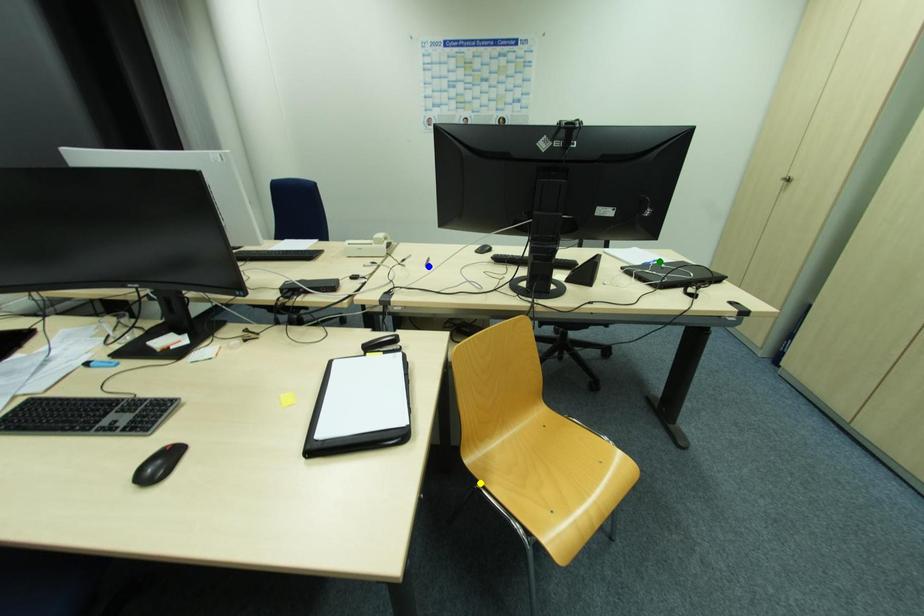
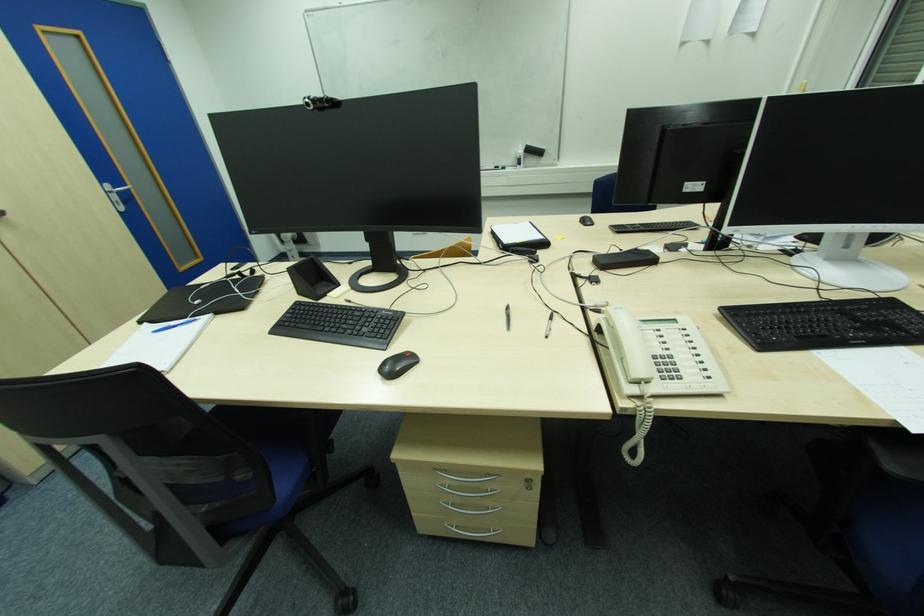
I am providing you with two images of the same scene from different viewpoints. Three points are marked in image1. Which point corresponds to a part or object that is occluded in image2?In image1, three points are marked. Which of them correspond to a part or object that is occluded in image2?Among the three points shown in image1, which one corresponds to a part or object that is no longer visible due to occlusion in image2?

Invisible in image2: yellow point.